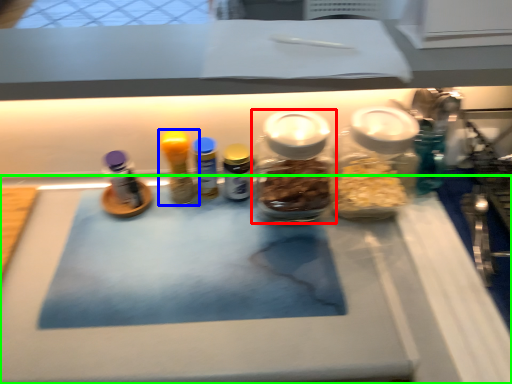
Question: Which object is the closest to the bottle (highlighted by a red box)? Choose among these: bottle (highlighted by a blue box) or table (highlighted by a green box).

Choices:
 (A) bottle
 (B) table

Answer: (A)